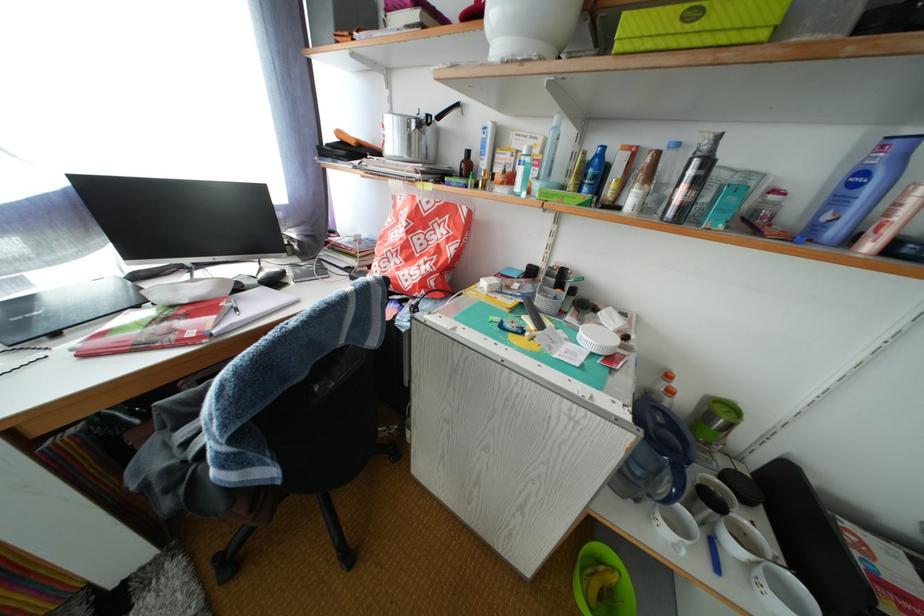
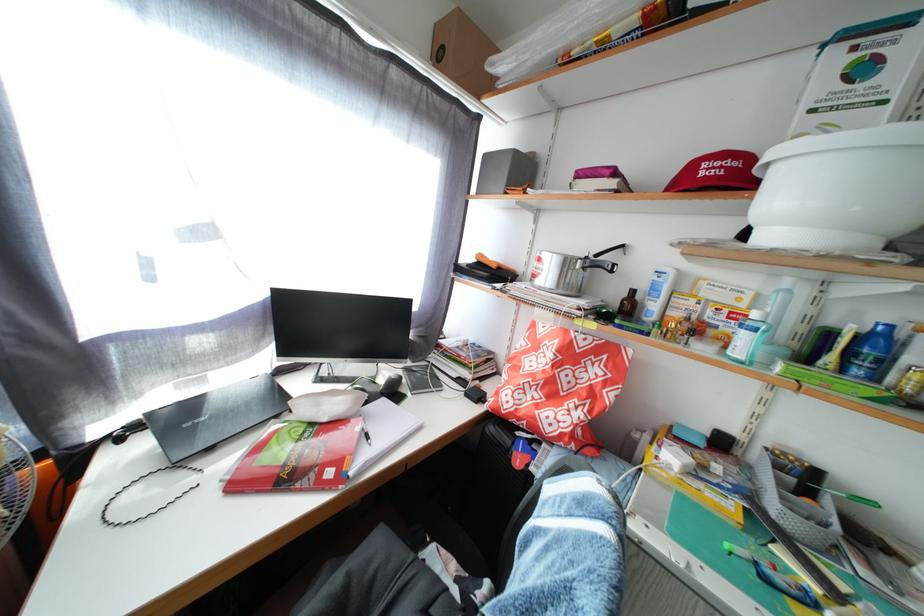
In the second image, find the point that corresponds to (593,196) in the first image.

(866, 378)